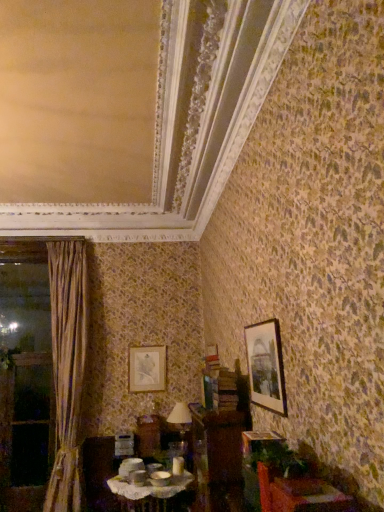
Where is `matte black picture frame at upper right, the 2th picture frame from the bottom`? The height and width of the screenshot is (512, 384). matte black picture frame at upper right, the 2th picture frame from the bottom is located at coordinates (266, 366).

Describe the element at coordinates (275, 457) in the screenshot. The width and height of the screenshot is (384, 512). I see `green leafy plant at lower right` at that location.

Identify the location of matte silver picture frame at center, the second picture frame positioned from the top. This screenshot has height=512, width=384. (147, 369).

What do you see at coordinates (147, 369) in the screenshot? This screenshot has height=512, width=384. I see `matte silver picture frame at center, the second picture frame positioned from the top` at bounding box center [147, 369].

The image size is (384, 512). What do you see at coordinates (180, 420) in the screenshot?
I see `matte white lampshade at center` at bounding box center [180, 420].

Based on the photo, in order to face wooden table at lower right, which is the first table in top-to-bottom order, should I rotate leftwards or rightwards?

Turn right by 16.423 degrees to look at wooden table at lower right, which is the first table in top-to-bottom order.

Where is `brown wooden dresser at center`? brown wooden dresser at center is located at coordinates (218, 431).

Where is `matte black picture frame at upper right, acting as the 1th picture frame starting from the front`? matte black picture frame at upper right, acting as the 1th picture frame starting from the front is located at coordinates (266, 366).

Is wooden table at lower right, which ranks as the first table in front-to-back order, inside or outside of matte silver picture frame at center, positioned as the 2th picture frame in right-to-left order?

wooden table at lower right, which ranks as the first table in front-to-back order, lies outside matte silver picture frame at center, positioned as the 2th picture frame in right-to-left order.

Does wooden table at lower right, which is the first table in top-to-bottom order, touch matte silver picture frame at center, the first picture frame when ordered from left to right?

No, wooden table at lower right, which is the first table in top-to-bottom order, is not touching matte silver picture frame at center, the first picture frame when ordered from left to right.

Which is behind, point (323, 508) or point (151, 376)?

The point (151, 376) is behind.

Locate an element on the screen. The width and height of the screenshot is (384, 512). picture frame on the left of wooden table at lower right, which ranks as the first table in front-to-back order is located at coordinates (147, 369).

Would you say wooden window frame at left is to the left or to the right of matte white lampshade at center in the picture?

In the image, wooden window frame at left appears on the left side of matte white lampshade at center.

From the image's perspective, which one is positioned higher, wooden window frame at left or matte white lampshade at center?

matte white lampshade at center appears higher in the image.

The height and width of the screenshot is (512, 384). In order to click on window behind the matte white lampshade at center in this screenshot , I will do `click(25, 385)`.

Who is taller, wooden window frame at left or matte white lampshade at center?

wooden window frame at left.

Does matte ceramic bowls at center, marked as the second table in a right-to-left arrangement, have a greater height compared to green leafy plant at lower right?

Indeed, matte ceramic bowls at center, marked as the second table in a right-to-left arrangement, has a greater height compared to green leafy plant at lower right.

From the image's perspective, is matte ceramic bowls at center, which is the first table in left-to-right order, on green leafy plant at lower right?

Actually, matte ceramic bowls at center, which is the first table in left-to-right order, appears below green leafy plant at lower right in the image.

Based on the photo, which object is closer to the camera taking this photo, matte ceramic bowls at center, which is the second table in top-to-bottom order, or green leafy plant at lower right?

green leafy plant at lower right is closer to the camera.

Is wooden table at lower right, the 2th table in the back-to-front sequence, in contact with brown wooden dresser at center?

No, wooden table at lower right, the 2th table in the back-to-front sequence, is not making contact with brown wooden dresser at center.

Identify the location of dresser behind the wooden table at lower right, marked as the 2th table in a left-to-right arrangement. (218, 431).

Is point (303, 478) behind point (220, 395)?

No, it is not.

Is wooden table at lower right, arranged as the 2th table when ordered from the bottom, in front of or behind brown wooden dresser at center in the image?

In the image, wooden table at lower right, arranged as the 2th table when ordered from the bottom, appears in front of brown wooden dresser at center.

Is silky beige curtain at left turned away from wooden table at lower right, marked as the 2th table in a left-to-right arrangement?

That's not correct — silky beige curtain at left is not looking away from wooden table at lower right, marked as the 2th table in a left-to-right arrangement.

Is silky beige curtain at left thinner than wooden table at lower right, arranged as the first table when viewed from the right?

No, silky beige curtain at left is not thinner than wooden table at lower right, arranged as the first table when viewed from the right.

Is silky beige curtain at left next to wooden table at lower right, arranged as the first table when viewed from the right, and touching it?

No, silky beige curtain at left is not making contact with wooden table at lower right, arranged as the first table when viewed from the right.

Can you tell me how much silky beige curtain at left and wooden table at lower right, which is the first table in top-to-bottom order, differ in facing direction?

The angular difference between silky beige curtain at left and wooden table at lower right, which is the first table in top-to-bottom order, is 85.2 degrees.

Looking at this image, from the image's perspective, is matte black picture frame at upper right, the 2th picture frame from the bottom, located beneath matte silver picture frame at center, which ranks as the 2th picture frame in front-to-back order?

Incorrect, from the image's perspective, matte black picture frame at upper right, the 2th picture frame from the bottom, is higher than matte silver picture frame at center, which ranks as the 2th picture frame in front-to-back order.

Is matte black picture frame at upper right, marked as the first picture frame in a top-to-bottom arrangement, next to matte silver picture frame at center, acting as the first picture frame starting from the back, and touching it?

matte black picture frame at upper right, marked as the first picture frame in a top-to-bottom arrangement, and matte silver picture frame at center, acting as the first picture frame starting from the back, are clearly separated.

Can you confirm if matte black picture frame at upper right, the 2th picture frame from the bottom, is thinner than matte silver picture frame at center, which ranks as the 2th picture frame in front-to-back order?

No, matte black picture frame at upper right, the 2th picture frame from the bottom, is not thinner than matte silver picture frame at center, which ranks as the 2th picture frame in front-to-back order.

Is matte black picture frame at upper right, marked as the first picture frame in a top-to-bottom arrangement, oriented towards matte silver picture frame at center, which ranks as the 2th picture frame in front-to-back order?

No, matte black picture frame at upper right, marked as the first picture frame in a top-to-bottom arrangement, is not oriented towards matte silver picture frame at center, which ranks as the 2th picture frame in front-to-back order.

Considering the relative positions of matte silver picture frame at center, which appears as the first picture frame when ordered from the bottom, and matte ceramic bowls at center, which is counted as the 1th table, starting from the back, in the image provided, is matte silver picture frame at center, which appears as the first picture frame when ordered from the bottom, to the right of matte ceramic bowls at center, which is counted as the 1th table, starting from the back, from the viewer's perspective?

No, matte silver picture frame at center, which appears as the first picture frame when ordered from the bottom, is not to the right of matte ceramic bowls at center, which is counted as the 1th table, starting from the back.

Between matte silver picture frame at center, acting as the first picture frame starting from the back, and matte ceramic bowls at center, marked as the second table in a right-to-left arrangement, which one has smaller size?

With smaller size is matte silver picture frame at center, acting as the first picture frame starting from the back.

Is matte silver picture frame at center, the second picture frame positioned from the top, inside the boundaries of matte ceramic bowls at center, which is counted as the 1th table, starting from the back, or outside?

matte silver picture frame at center, the second picture frame positioned from the top, is located beyond the bounds of matte ceramic bowls at center, which is counted as the 1th table, starting from the back.

Considering the sizes of objects matte silver picture frame at center, which appears as the first picture frame when ordered from the bottom, and matte ceramic bowls at center, marked as the second table in a right-to-left arrangement, in the image provided, who is wider, matte silver picture frame at center, which appears as the first picture frame when ordered from the bottom, or matte ceramic bowls at center, marked as the second table in a right-to-left arrangement,?

matte ceramic bowls at center, marked as the second table in a right-to-left arrangement, is wider.

Starting from the wooden table at lower right, the 2th table in the back-to-front sequence, which picture frame is the 2nd one behind? Please provide its 2D coordinates.

[(147, 369)]

Image resolution: width=384 pixels, height=512 pixels. Find the location of `table lamp in front of the wooden window frame at left`. table lamp in front of the wooden window frame at left is located at coordinates (180, 420).

When comparing their distances from wooden window frame at left, does matte white lampshade at center or brown wooden dresser at center seem further?

The object further to wooden window frame at left is brown wooden dresser at center.

Considering their positions, is matte ceramic bowls at center, the 1th table ordered from the bottom, positioned further to green leafy plant at lower right than brown wooden dresser at center?

matte ceramic bowls at center, the 1th table ordered from the bottom, is positioned further to the anchor green leafy plant at lower right.

Which object lies further to the anchor point silky beige curtain at left, matte black picture frame at upper right, acting as the 1th picture frame starting from the front, or wooden window frame at left?

matte black picture frame at upper right, acting as the 1th picture frame starting from the front, is positioned further to the anchor silky beige curtain at left.

When comparing their distances from wooden window frame at left, does silky beige curtain at left or matte white lampshade at center seem further?

matte white lampshade at center is positioned further to the anchor wooden window frame at left.

Considering their positions, is brown wooden dresser at center positioned closer to wooden window frame at left than matte silver picture frame at center, acting as the first picture frame starting from the back?

matte silver picture frame at center, acting as the first picture frame starting from the back, is closer to wooden window frame at left.

Which object lies further to the anchor point brown wooden dresser at center, matte white lampshade at center or matte ceramic bowls at center, the 1th table ordered from the bottom?

matte ceramic bowls at center, the 1th table ordered from the bottom, is positioned further to the anchor brown wooden dresser at center.

Considering their positions, is matte white lampshade at center positioned further to brown wooden dresser at center than wooden table at lower right, marked as the 2th table in a left-to-right arrangement?

Based on the image, wooden table at lower right, marked as the 2th table in a left-to-right arrangement, appears to be further to brown wooden dresser at center.

Estimate the real-world distances between objects in this image. Which object is further from matte silver picture frame at center, positioned as the 2th picture frame in right-to-left order, wooden table at lower right, marked as the 2th table in a left-to-right arrangement, or matte white lampshade at center?

wooden table at lower right, marked as the 2th table in a left-to-right arrangement, is further to matte silver picture frame at center, positioned as the 2th picture frame in right-to-left order.

Identify the location of picture frame located between wooden table at lower right, arranged as the 2th table when ordered from the bottom, and silky beige curtain at left in the depth direction. Image resolution: width=384 pixels, height=512 pixels. pos(266,366).

The width and height of the screenshot is (384, 512). I want to click on table lamp positioned between wooden table at lower right, arranged as the first table when viewed from the right, and wooden window frame at left from near to far, so click(180, 420).

Image resolution: width=384 pixels, height=512 pixels. What are the coordinates of `dresser that lies between matte black picture frame at upper right, acting as the first picture frame starting from the right, and matte ceramic bowls at center, which is counted as the 1th table, starting from the back, from top to bottom` in the screenshot? It's located at (218, 431).

The image size is (384, 512). I want to click on dresser between green leafy plant at lower right and matte white lampshade at center along the z-axis, so click(x=218, y=431).